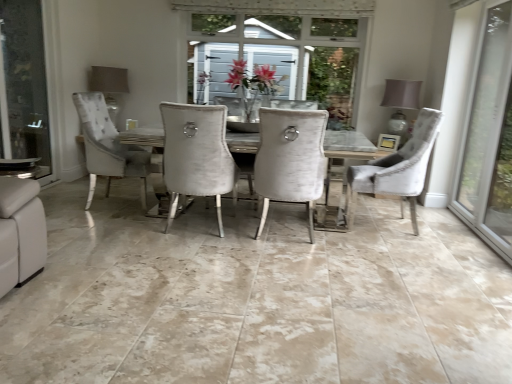
Question: Is matte gray lampshade at upper right, the second lamp when ordered from left to right, oriented away from matte gray lampshade at upper left, marked as the 2th lamp in a right-to-left arrangement?

Choices:
 (A) no
 (B) yes

Answer: (A)

Question: Does matte gray lampshade at upper right, which is the 1th lamp from right to left, have a lesser width compared to matte gray lampshade at upper left, marked as the 2th lamp in a right-to-left arrangement?

Choices:
 (A) yes
 (B) no

Answer: (B)

Question: Is matte gray lampshade at upper right, the second lamp when ordered from left to right, oriented towards matte gray lampshade at upper left, which is counted as the 1th lamp, starting from the left?

Choices:
 (A) yes
 (B) no

Answer: (B)

Question: Does matte gray lampshade at upper right, which is the 1th lamp from right to left, appear on the left side of matte gray lampshade at upper left, marked as the 2th lamp in a right-to-left arrangement?

Choices:
 (A) no
 (B) yes

Answer: (A)

Question: Does matte gray lampshade at upper right, which is the 1th lamp from right to left, lie behind matte gray lampshade at upper left, which is counted as the 1th lamp, starting from the left?

Choices:
 (A) no
 (B) yes

Answer: (A)

Question: Considering the relative sizes of matte gray lampshade at upper right, which is the 1th lamp from right to left, and matte gray lampshade at upper left, marked as the 2th lamp in a right-to-left arrangement, in the image provided, is matte gray lampshade at upper right, which is the 1th lamp from right to left, bigger than matte gray lampshade at upper left, marked as the 2th lamp in a right-to-left arrangement,?

Choices:
 (A) no
 (B) yes

Answer: (B)

Question: Is velvet grey chair at right, the 1th chair in the right-to-left sequence, inside matte gray lampshade at upper right, the second lamp when ordered from left to right?

Choices:
 (A) no
 (B) yes

Answer: (A)

Question: Is matte gray lampshade at upper right, the second lamp when ordered from left to right, thinner than velvet grey chair at right, which appears as the second chair when viewed from the left?

Choices:
 (A) yes
 (B) no

Answer: (A)

Question: Is matte gray lampshade at upper right, which is the 1th lamp from right to left, wider than velvet grey chair at right, which appears as the second chair when viewed from the left?

Choices:
 (A) yes
 (B) no

Answer: (B)

Question: From a real-world perspective, is matte gray lampshade at upper right, which is the 1th lamp from right to left, under velvet grey chair at right, which appears as the second chair when viewed from the left?

Choices:
 (A) no
 (B) yes

Answer: (A)

Question: Does matte gray lampshade at upper right, the second lamp when ordered from left to right, appear on the left side of velvet grey chair at right, which appears as the second chair when viewed from the left?

Choices:
 (A) no
 (B) yes

Answer: (A)

Question: Does matte gray lampshade at upper right, which is the 1th lamp from right to left, have a lesser height compared to velvet grey chair at right, the 1th chair in the right-to-left sequence?

Choices:
 (A) no
 (B) yes

Answer: (B)

Question: Can you confirm if clear glass screen door at left is wider than velvet grey chair at right, the 1th chair in the right-to-left sequence?

Choices:
 (A) yes
 (B) no

Answer: (B)